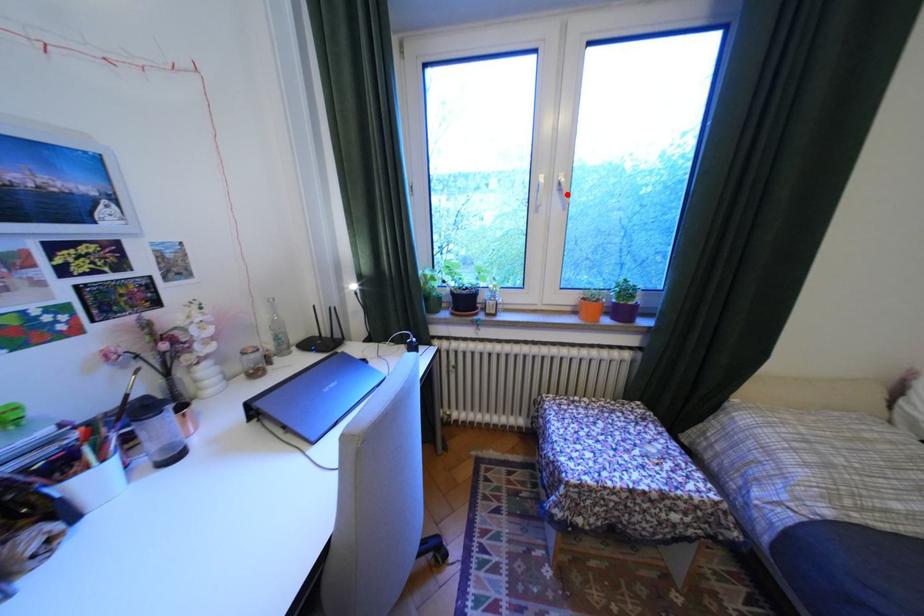
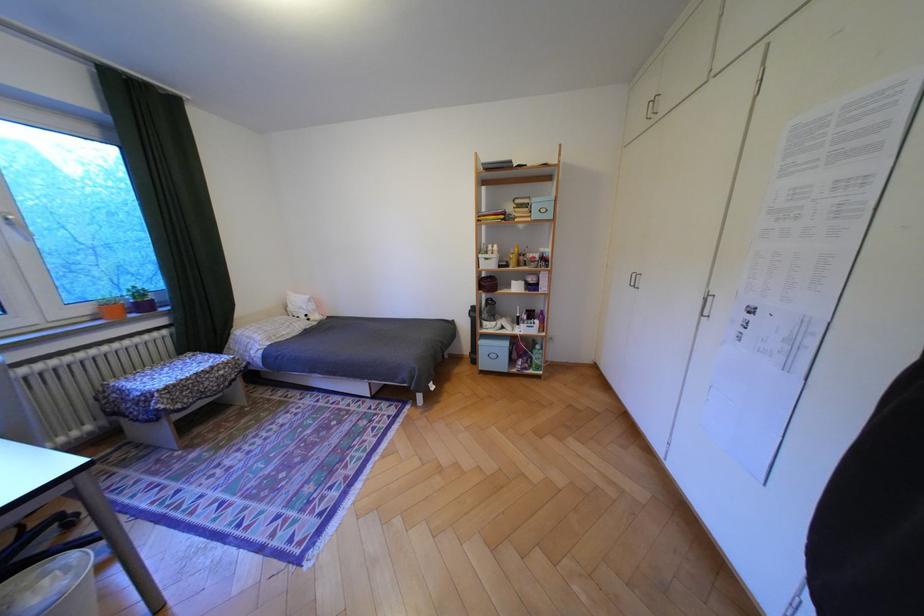
Question: I am providing you with two images of the same scene from different viewpoints. In image1, a red point is highlighted. Considering the same 3D point in image2, which of the following is correct?

Choices:
 (A) It is closer
 (B) It is farther

Answer: (B)